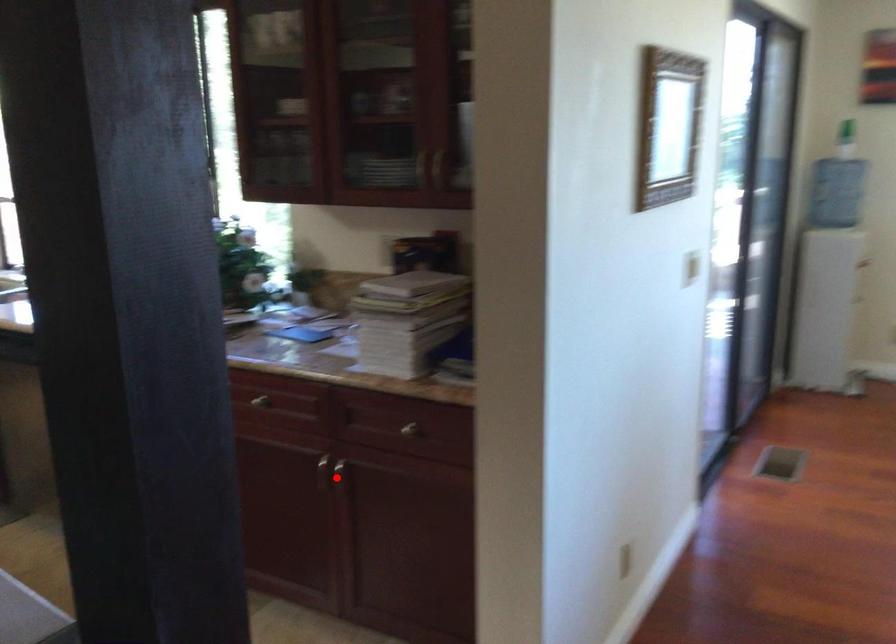
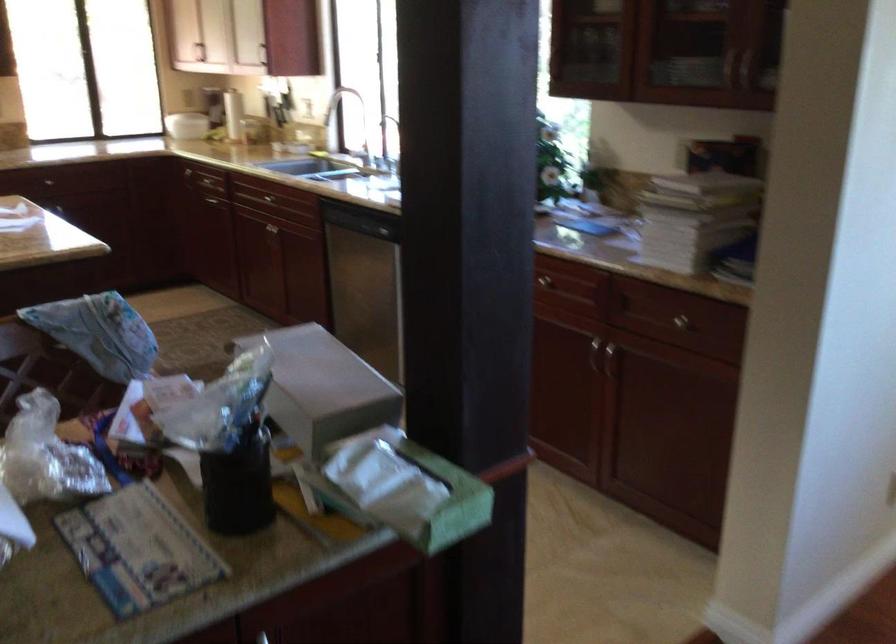
In the second image, find the point that corresponds to the highlighted location in the first image.

(610, 361)